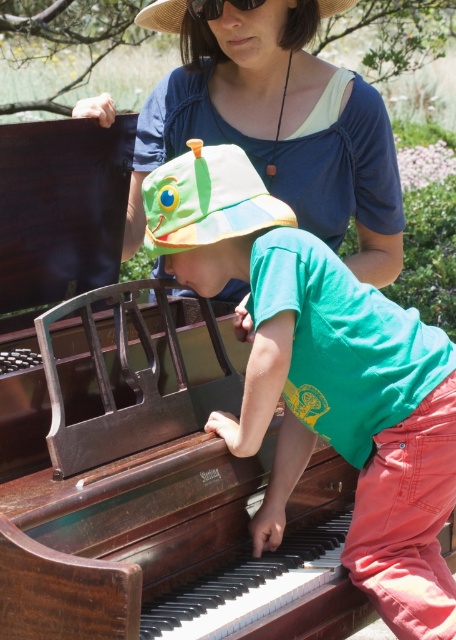
Question: Is the position of green cotton hat at upper center more distant than that of straw hat at upper center?

Choices:
 (A) yes
 (B) no

Answer: (B)

Question: Can you confirm if wooden piano at center is thinner than straw hat at upper center?

Choices:
 (A) yes
 (B) no

Answer: (B)

Question: Which point is farther from the camera taking this photo?

Choices:
 (A) (221, 177)
 (B) (113, 413)
 (C) (186, 1)

Answer: (C)

Question: Which point is closer to the camera?

Choices:
 (A) straw hat at upper center
 (B) black plastic goggles at upper center
 (C) multicolored fabric hat at center
 (D) wooden piano at center

Answer: (D)

Question: Estimate the real-world distances between objects in this image. Which object is closer to the wooden piano at center?

Choices:
 (A) black plastic goggles at upper center
 (B) green cotton hat at upper center
 (C) multicolored fabric hat at center
 (D) straw hat at upper center

Answer: (B)

Question: Can you confirm if wooden piano at center is positioned to the right of black plastic goggles at upper center?

Choices:
 (A) no
 (B) yes

Answer: (A)